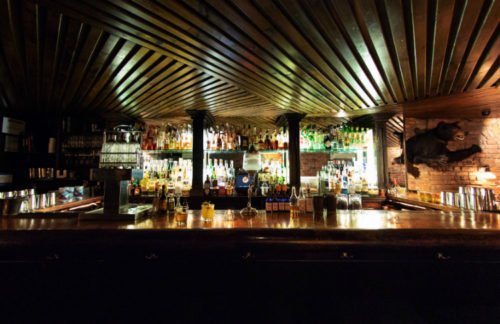
Locate an element on the screen. The height and width of the screenshot is (324, 500). liquor is located at coordinates (237, 163).